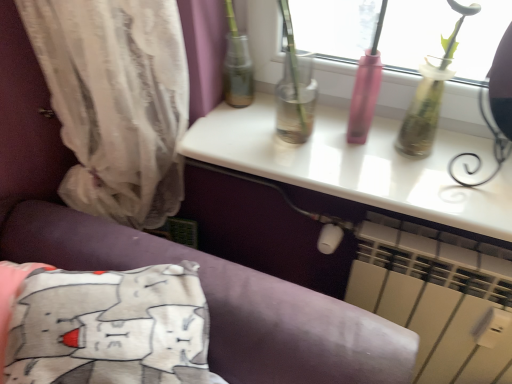
Find the location of a particular element. This screenshot has width=512, height=384. empty space that is ontop of white plastic radiator at lower right is located at coordinates (434, 236).